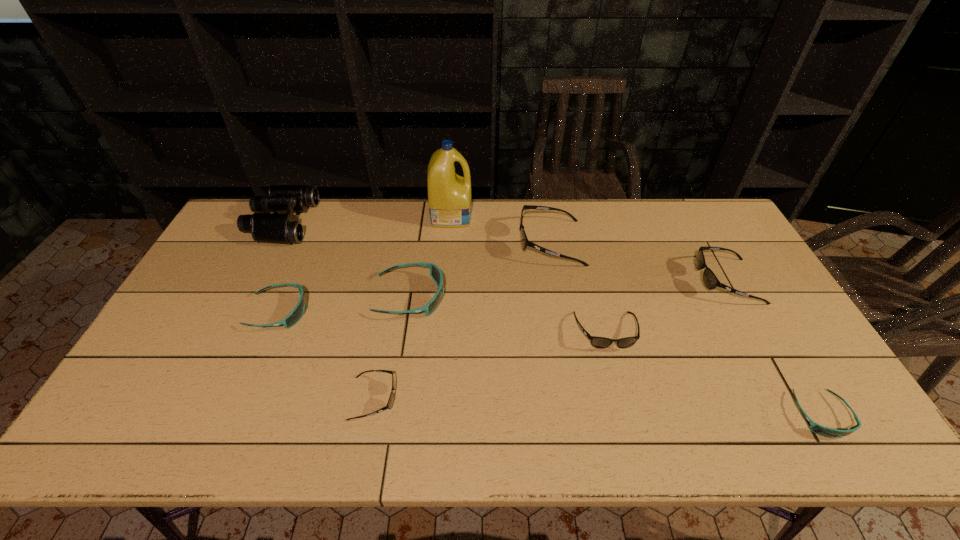
Identify the location of object that is at the far left corner. (285, 228).

The width and height of the screenshot is (960, 540). In order to click on object that is at the near right corner in this screenshot , I will do `click(827, 432)`.

In the image, there is a desktop. Where is `free space at the far edge`? free space at the far edge is located at coordinates (527, 228).

In the image, there is a desktop. At what (x,y) coordinates should I click in order to perform the action: click on vacant space at the near edge. Please return your answer as a coordinate pair (x, y). Looking at the image, I should click on (575, 418).

Find the location of a particular element. vacant region at the right edge of the desktop is located at coordinates (772, 306).

You are a GUI agent. You are given a task and a screenshot of the screen. Output one action in this format:
    pyautogui.click(x=<x>, y=<y>)
    Task: Click on the vacant region at the far left corner of the desktop
    
    Given the screenshot: What is the action you would take?
    pyautogui.click(x=243, y=234)

Locate an element on the screen. free space at the near right corner of the desktop is located at coordinates (824, 438).

Image resolution: width=960 pixels, height=540 pixels. I want to click on vacant space that is in between the tallest object and the biggest cyan sunglasses, so click(x=430, y=256).

Locate an element on the screen. This screenshot has width=960, height=540. free point between the second biggest cyan sunglasses and the third farthest gray sunglasses is located at coordinates tap(442, 322).

Where is `free space between the nearest gray sunglasses and the black binoculars`? The height and width of the screenshot is (540, 960). free space between the nearest gray sunglasses and the black binoculars is located at coordinates (327, 310).